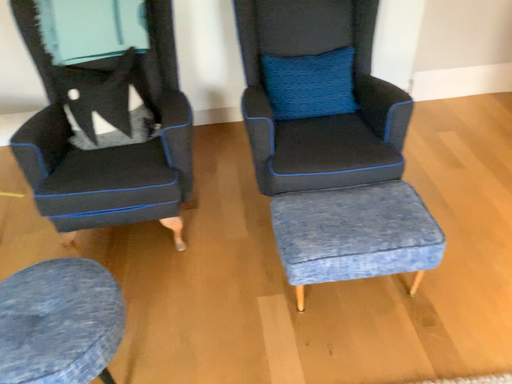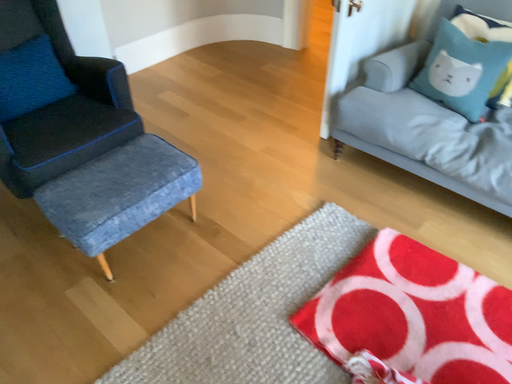
Question: Which way did the camera rotate in the video?

Choices:
 (A) rotated right
 (B) rotated left

Answer: (A)